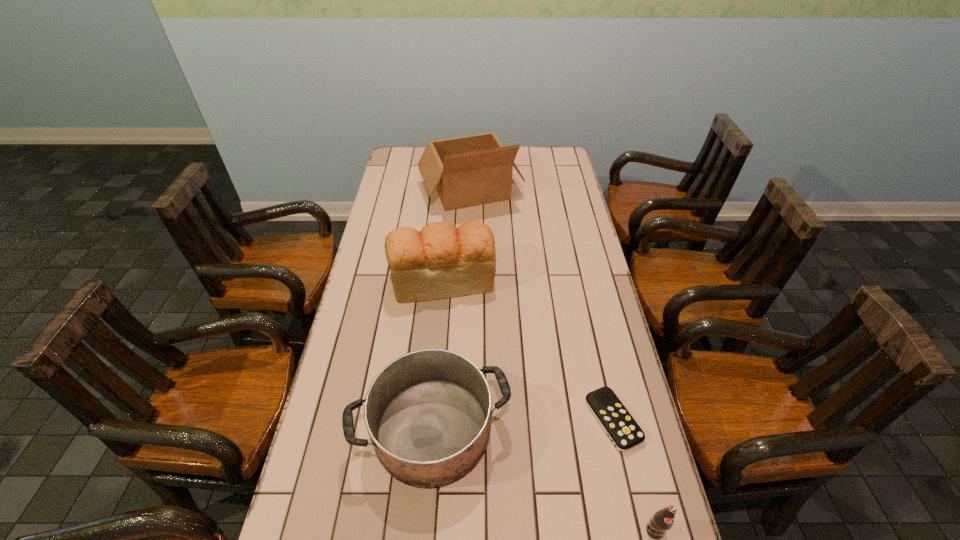
At what (x,y) coordinates should I click in order to perform the action: click on empty space between the shortest object and the bread. Please return your answer as a coordinate pair (x, y). Image resolution: width=960 pixels, height=540 pixels. Looking at the image, I should click on (528, 350).

The image size is (960, 540). I want to click on empty location between the saucepan and the shortest object, so click(523, 424).

This screenshot has height=540, width=960. I want to click on free space between the tallest object and the saucepan, so click(x=451, y=309).

Locate an element on the screen. The width and height of the screenshot is (960, 540). empty location between the saucepan and the tallest object is located at coordinates (451, 309).

Where is `free space between the shortest object and the second tallest object`? free space between the shortest object and the second tallest object is located at coordinates (528, 350).

Image resolution: width=960 pixels, height=540 pixels. Find the location of `object that is the second closest one to the box`. object that is the second closest one to the box is located at coordinates (428, 413).

Where is `object that can be found as the third closest to the saucepan`? This screenshot has height=540, width=960. object that can be found as the third closest to the saucepan is located at coordinates (663, 520).

Where is `vacant space that satisfies the following two spatial constraints: 1. on the front side of the remote control; 2. on the left side of the bread`? The width and height of the screenshot is (960, 540). vacant space that satisfies the following two spatial constraints: 1. on the front side of the remote control; 2. on the left side of the bread is located at coordinates (432, 420).

Identify the location of free space that satisfies the following two spatial constraints: 1. on the back side of the second tallest object; 2. on the right side of the tallest object. The width and height of the screenshot is (960, 540). (450, 190).